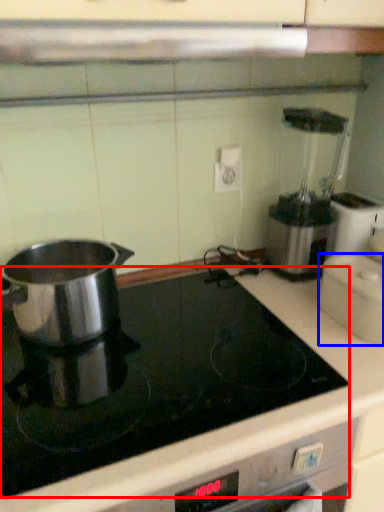
Question: Which of the following is the farthest to the observer, kitchen appliance (highlighted by a red box) or kitchen appliance (highlighted by a blue box)?

Choices:
 (A) kitchen appliance
 (B) kitchen appliance

Answer: (B)